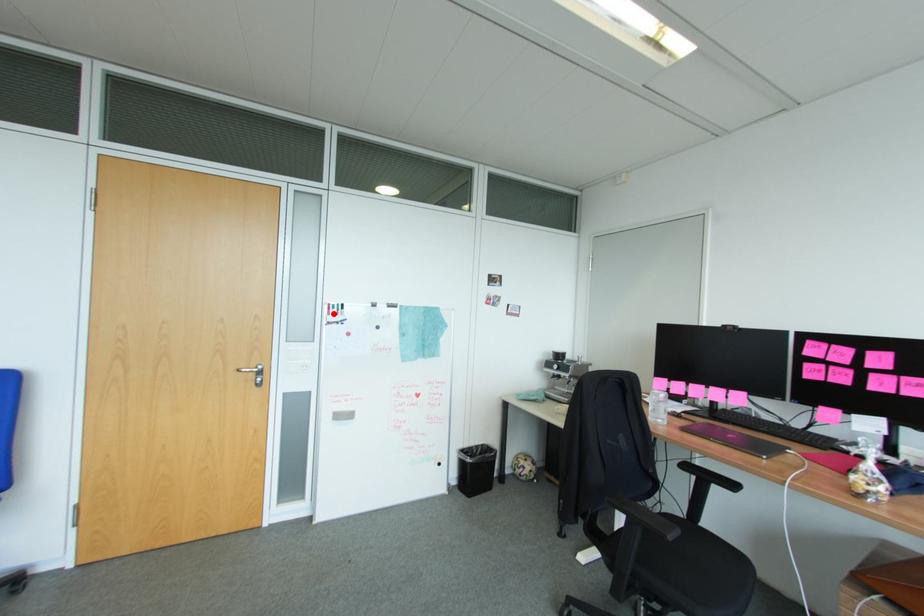
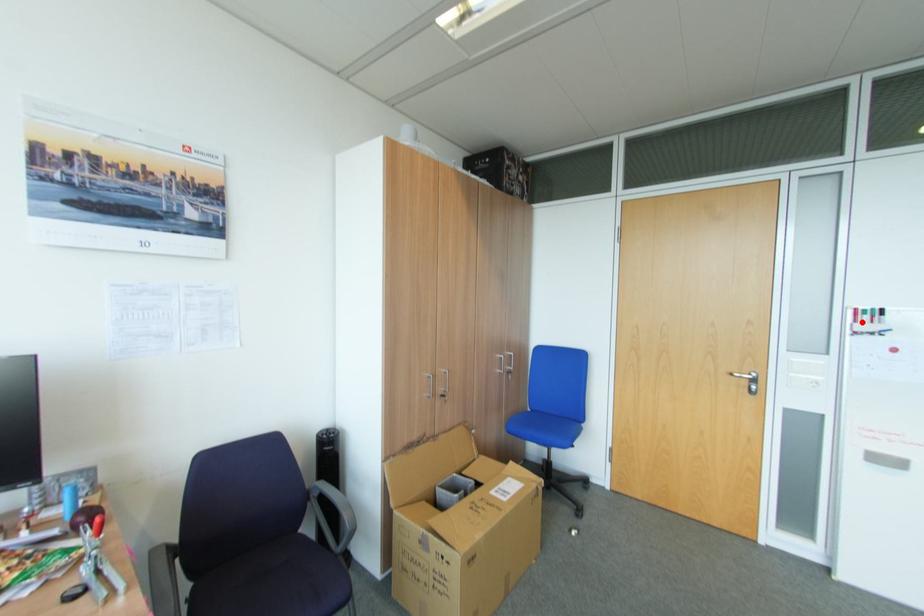
I am providing you with two images of the same scene from different viewpoints. A red point is marked on the first image and another point is marked on the second image. Are the points marked in image1 and image2 representing the same 3D position?

Yes